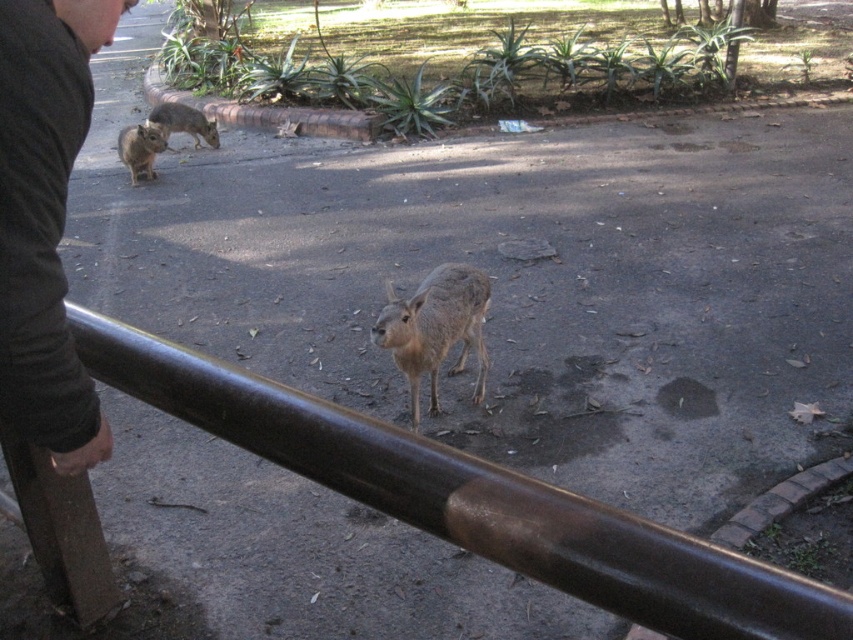
You are standing at point (473, 499) in the park scene. What object is located exactly at your current position?

The brown polished metal rail at center is located exactly at point (473, 499).

You are a park visitor who wants to take a photo of the fur like gray animal at center. The camera you are using has a focus point at point (434, 330). Will this point help you focus on the fur like gray animal at center?

Yes, because the point (434, 330) corresponds to the fur like gray animal at center, so using this focus point will allow you to focus on it.